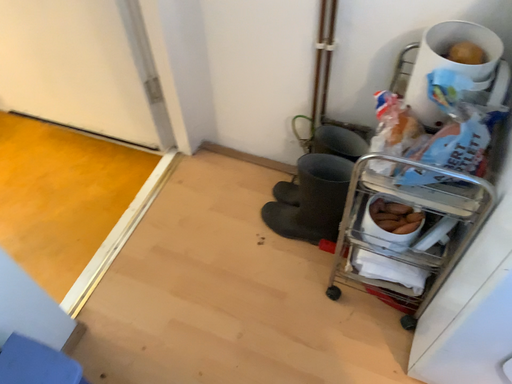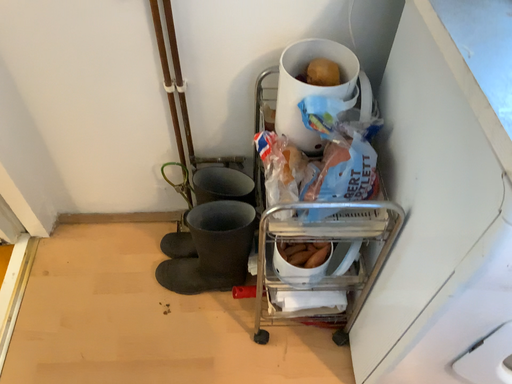
Question: How did the camera likely rotate when shooting the video?

Choices:
 (A) rotated right
 (B) rotated left

Answer: (A)